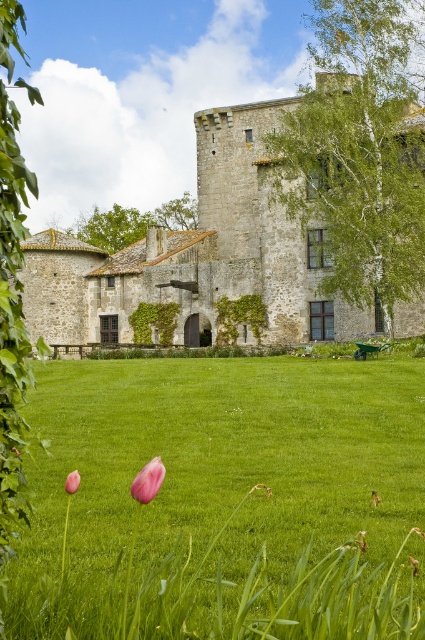
Question: Which is farther from the stone castle at center?

Choices:
 (A) green grass at lower center
 (B) pink matte tulip at lower left

Answer: (B)

Question: From the image, what is the correct spatial relationship of stone castle at center in relation to pink matte tulip at lower center?

Choices:
 (A) above
 (B) below

Answer: (A)

Question: Which of the following is the farthest from the observer?

Choices:
 (A) (76, 476)
 (B) (67, 307)
 (C) (396, 465)

Answer: (B)

Question: Does green grass at lower center lie behind stone castle at center?

Choices:
 (A) yes
 (B) no

Answer: (B)

Question: Can you confirm if stone castle at center is wider than pink matte tulip at lower center?

Choices:
 (A) yes
 (B) no

Answer: (A)

Question: Among these points, which one is farthest from the camera?

Choices:
 (A) (76, 470)
 (B) (206, 237)
 (C) (190, 586)
 (D) (141, 484)

Answer: (B)